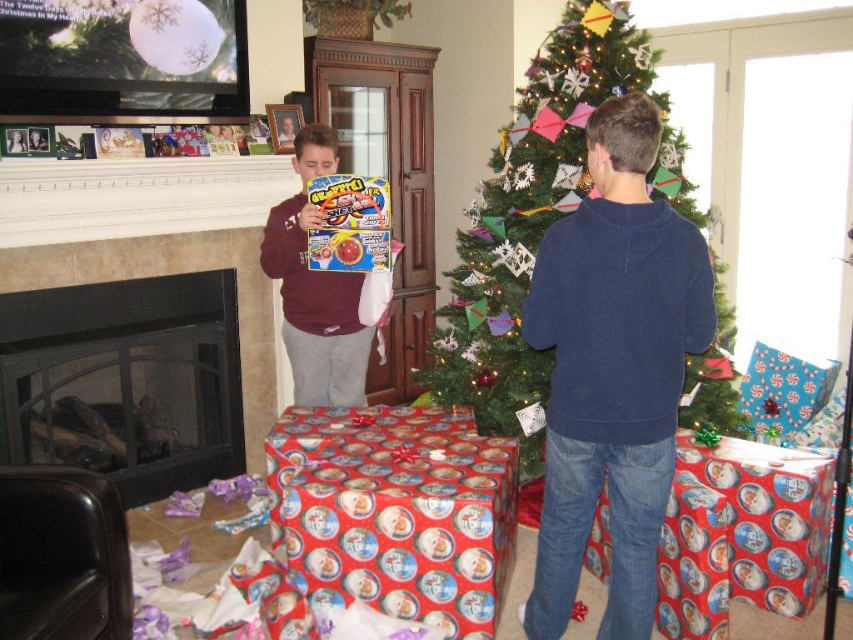
Question: Among these objects, which one is farthest from the camera?

Choices:
 (A) black glass fireplace at lower left
 (B) maroon fleece sweater at center
 (C) dark blue sweater at center

Answer: (A)

Question: Is dark blue sweater at center bigger than red shiny wrapping paper at lower center?

Choices:
 (A) yes
 (B) no

Answer: (A)

Question: Is the position of green matte christmas tree at center more distant than that of black glass fireplace at lower left?

Choices:
 (A) yes
 (B) no

Answer: (A)

Question: Is black glass fireplace at lower left smaller than maroon fleece sweater at center?

Choices:
 (A) yes
 (B) no

Answer: (B)

Question: Which is farther from the glossy plastic game at center?

Choices:
 (A) dark blue sweater at center
 (B) green matte christmas tree at center

Answer: (A)

Question: Which point is closer to the camera?

Choices:
 (A) green matte christmas tree at center
 (B) red shiny wrapping paper at lower center
 (C) black glass fireplace at lower left

Answer: (B)